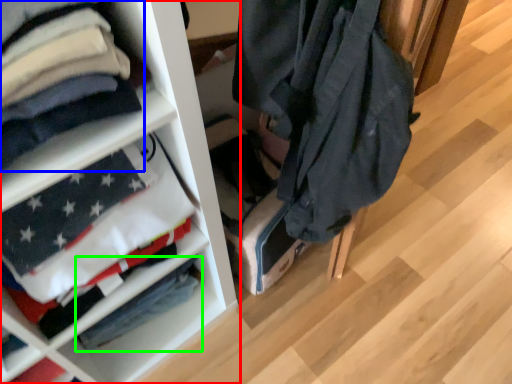
Question: Which object is the farthest from shelf (highlighted by a red box)? Choose among these: cloak (highlighted by a blue box) or flag (highlighted by a green box).

Choices:
 (A) cloak
 (B) flag

Answer: (A)